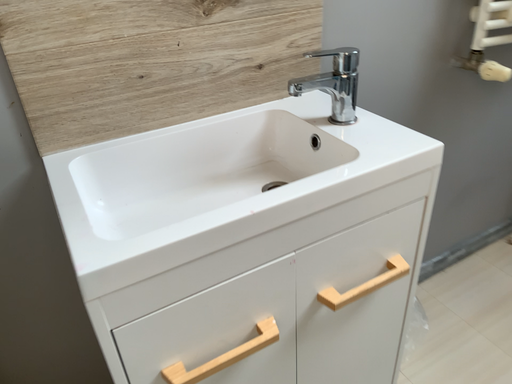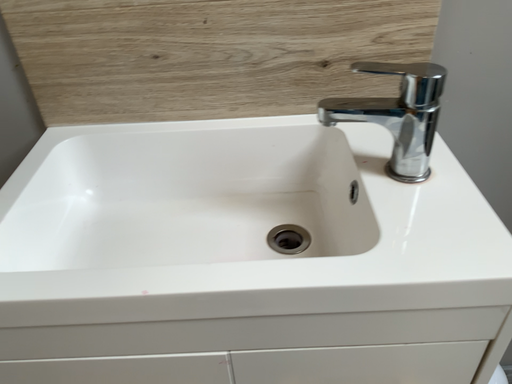
Question: Which way did the camera rotate in the video?

Choices:
 (A) rotated left
 (B) rotated right

Answer: (A)